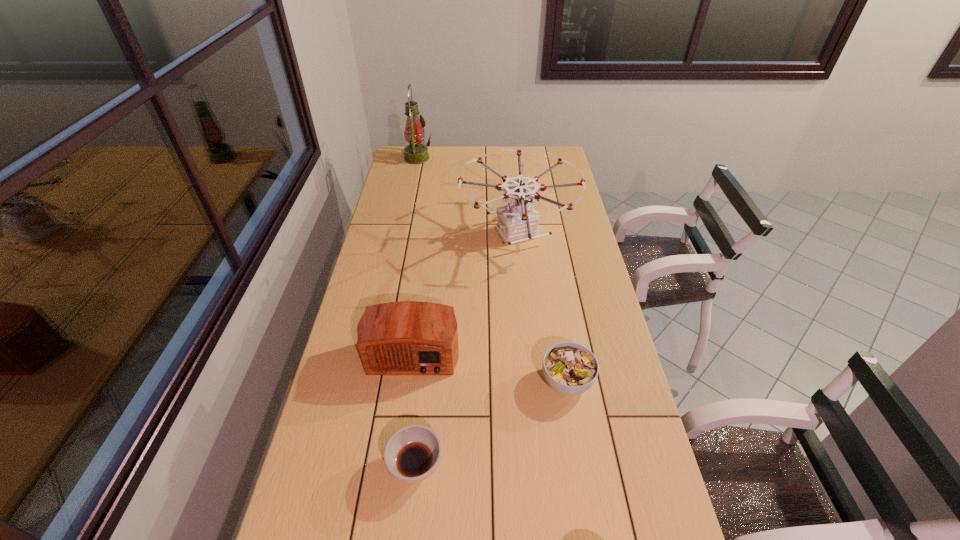
This screenshot has width=960, height=540. Identify the location of free space between the oil lamp and the right soup bowl. (492, 270).

You are a GUI agent. You are given a task and a screenshot of the screen. Output one action in this format:
    pyautogui.click(x=<x>, y=<y>)
    Task: Click on the empty location between the radio receiver and the oil lamp
    This screenshot has height=540, width=960.
    Given the screenshot: What is the action you would take?
    pyautogui.click(x=415, y=254)

At what (x,y) coordinates should I click in order to perform the action: click on free spot between the farthest object and the right soup bowl. Please return your answer as a coordinate pair (x, y). Looking at the image, I should click on (492, 270).

Identify the location of object identified as the closest to the third shortest object. (413, 453).

At what (x,y) coordinates should I click in order to perform the action: click on the third closest object to the third tallest object. Please return your answer as a coordinate pair (x, y). Looking at the image, I should click on (569, 368).

Identify which soup bowl is the second nearest to the drone. Please provide its 2D coordinates. Your answer should be formatted as a tuple, i.e. [(x, y)], where the tuple contains the x and y coordinates of a point satisfying the conditions above.

[(413, 453)]

Point out which soup bowl is positioned as the nearest to the radio receiver. Please provide its 2D coordinates. Your answer should be formatted as a tuple, i.e. [(x, y)], where the tuple contains the x and y coordinates of a point satisfying the conditions above.

[(413, 453)]

The image size is (960, 540). In order to click on free space that satisfies the following two spatial constraints: 1. on the back side of the farther soup bowl; 2. on the left side of the nearer soup bowl in this screenshot , I will do `click(425, 381)`.